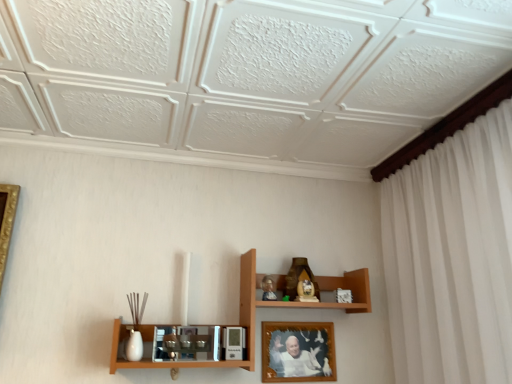
Question: Considering the relative sizes of wooden shelf at center and wooden photo frame at center in the image provided, is wooden shelf at center taller than wooden photo frame at center?

Choices:
 (A) yes
 (B) no

Answer: (A)

Question: Does wooden shelf at center have a greater width compared to wooden photo frame at center?

Choices:
 (A) no
 (B) yes

Answer: (B)

Question: Can you confirm if wooden shelf at center is bigger than wooden photo frame at center?

Choices:
 (A) no
 (B) yes

Answer: (B)

Question: Is wooden shelf at center aimed at wooden photo frame at center?

Choices:
 (A) no
 (B) yes

Answer: (B)

Question: Considering the relative positions of wooden shelf at center and wooden photo frame at center in the image provided, is wooden shelf at center behind wooden photo frame at center?

Choices:
 (A) yes
 (B) no

Answer: (B)

Question: From a real-world perspective, is wooden shelf at center above or below matte brown statue at upper center?

Choices:
 (A) below
 (B) above

Answer: (A)

Question: From the image's perspective, relative to matte brown statue at upper center, is wooden shelf at center above or below?

Choices:
 (A) below
 (B) above

Answer: (A)

Question: Looking at their shapes, would you say wooden shelf at center is wider or thinner than matte brown statue at upper center?

Choices:
 (A) thin
 (B) wide

Answer: (B)

Question: Considering the positions of point (253, 281) and point (298, 268), is point (253, 281) closer or farther from the camera than point (298, 268)?

Choices:
 (A) closer
 (B) farther

Answer: (A)

Question: Is matte brown statue at upper center in front of or behind wooden shelf at center in the image?

Choices:
 (A) behind
 (B) front

Answer: (A)

Question: Is matte brown statue at upper center wider or thinner than wooden shelf at center?

Choices:
 (A) thin
 (B) wide

Answer: (A)

Question: Is matte brown statue at upper center situated inside wooden shelf at center or outside?

Choices:
 (A) outside
 (B) inside

Answer: (B)

Question: Is matte brown statue at upper center bigger or smaller than wooden shelf at center?

Choices:
 (A) small
 (B) big

Answer: (A)

Question: Looking at their shapes, would you say wooden photo frame at center is wider or thinner than matte brown statue at upper center?

Choices:
 (A) wide
 (B) thin

Answer: (B)

Question: Is wooden photo frame at center inside or outside of matte brown statue at upper center?

Choices:
 (A) inside
 (B) outside

Answer: (B)